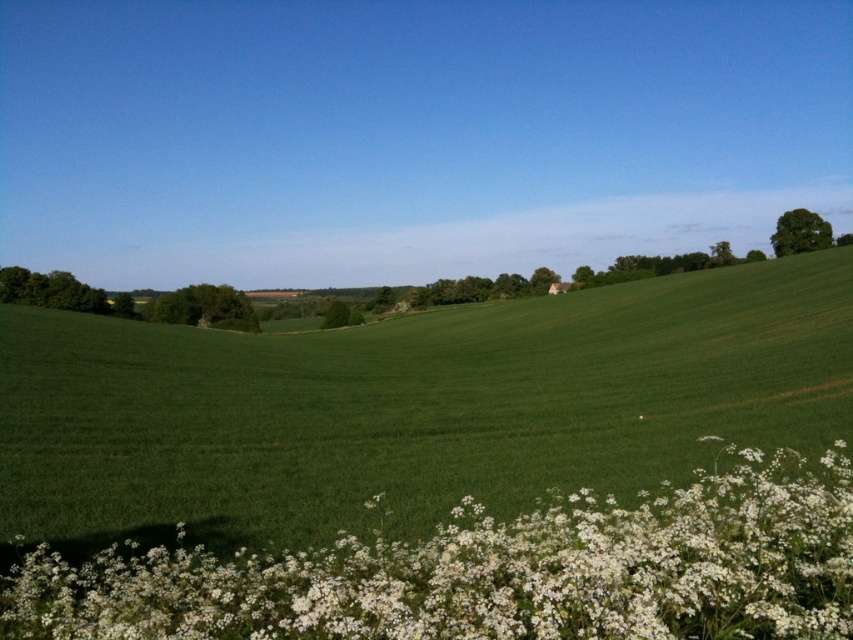
You are a photographer planning to capture the entire scene in one shot. Given that the green grassy field at center and the white fluffy flowers at lower center are both in your frame, which object will occupy more horizontal space in the photo?

The green grassy field at center will occupy more horizontal space in the photo because its width surpasses that of the white fluffy flowers at lower center.

You are a photographer planning to capture the green grassy field at center and the white fluffy flowers at lower center in a single shot. Based on their sizes, which object should you focus on to ensure both are in frame without needing to zoom in or out?

The green grassy field at center has a larger size compared to the white fluffy flowers at lower center, so focusing on the green grassy field at center will ensure both are in frame without needing to adjust the zoom.